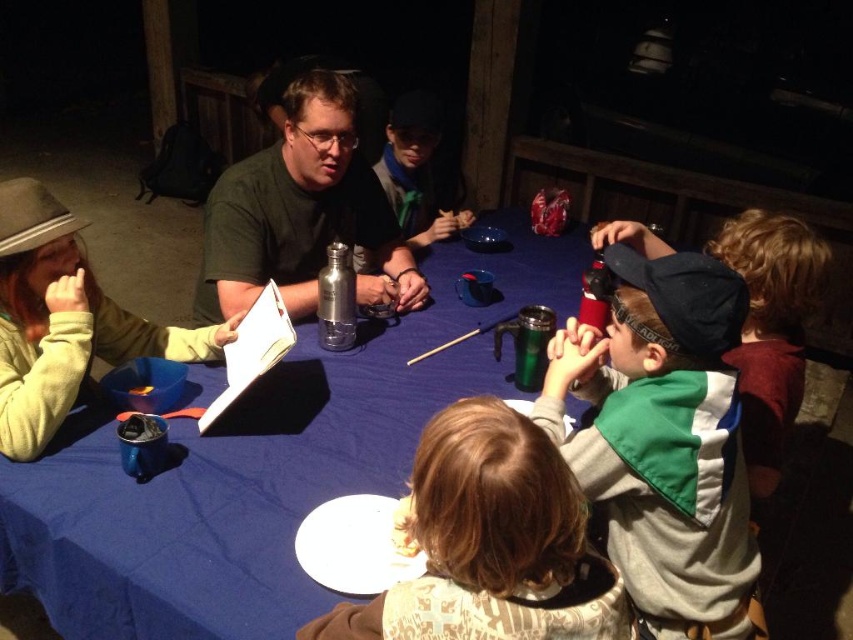
Question: Among these objects, which one is farthest from the camera?

Choices:
 (A) light brown hair at center
 (B) green scarf at center

Answer: (B)

Question: Is light brown hair at center to the right of green scarf at center from the viewer's perspective?

Choices:
 (A) yes
 (B) no

Answer: (A)

Question: Can you confirm if green fleece jacket at center is positioned to the right of green fleece vest at lower right?

Choices:
 (A) yes
 (B) no

Answer: (B)

Question: Estimate the real-world distances between objects in this image. Which object is closer to the green scarf at center?

Choices:
 (A) green fleece jacket at center
 (B) green fleece vest at lower right
 (C) blue fabric table at center
 (D) green matte shirt at center

Answer: (D)

Question: Does blue fabric table at center appear over green matte shirt at center?

Choices:
 (A) yes
 (B) no

Answer: (B)

Question: Based on their relative distances, which object is nearer to the green fleece vest at lower right?

Choices:
 (A) blue fabric table at center
 (B) green matte shirt at center
 (C) green scarf at center
 (D) green fleece jacket at center

Answer: (D)